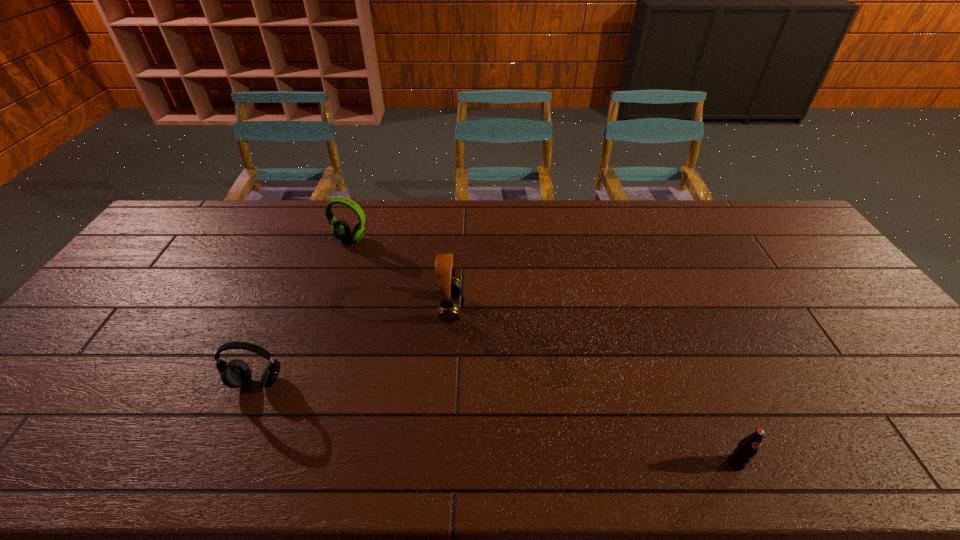
Identify the location of the second nearest headset. 449,288.

The height and width of the screenshot is (540, 960). Identify the location of the third nearest object. (449, 288).

This screenshot has width=960, height=540. Find the location of `the farthest headset`. the farthest headset is located at coordinates (341, 230).

At what (x,y) coordinates should I click in order to perform the action: click on the nearest headset. Please return your answer as a coordinate pair (x, y). The image size is (960, 540). Looking at the image, I should click on (236, 373).

The width and height of the screenshot is (960, 540). I want to click on the nearest object, so click(748, 447).

In order to click on the rightmost object in this screenshot , I will do `click(748, 447)`.

Where is `vacant space located on the ear cups of the second farthest object`? The image size is (960, 540). vacant space located on the ear cups of the second farthest object is located at coordinates (559, 308).

This screenshot has height=540, width=960. Find the location of `free point located 0.330m on the left of the farthest headset`. free point located 0.330m on the left of the farthest headset is located at coordinates (235, 240).

At what (x,y) coordinates should I click in order to perform the action: click on vacant space located on the ear cups of the nearest headset. Please return your answer as a coordinate pair (x, y). Looking at the image, I should click on click(x=220, y=470).

You are a GUI agent. You are given a task and a screenshot of the screen. Output one action in this format:
    pyautogui.click(x=<x>, y=<y>)
    Task: Click on the object situated at the far edge
    
    Given the screenshot: What is the action you would take?
    pyautogui.click(x=341, y=230)